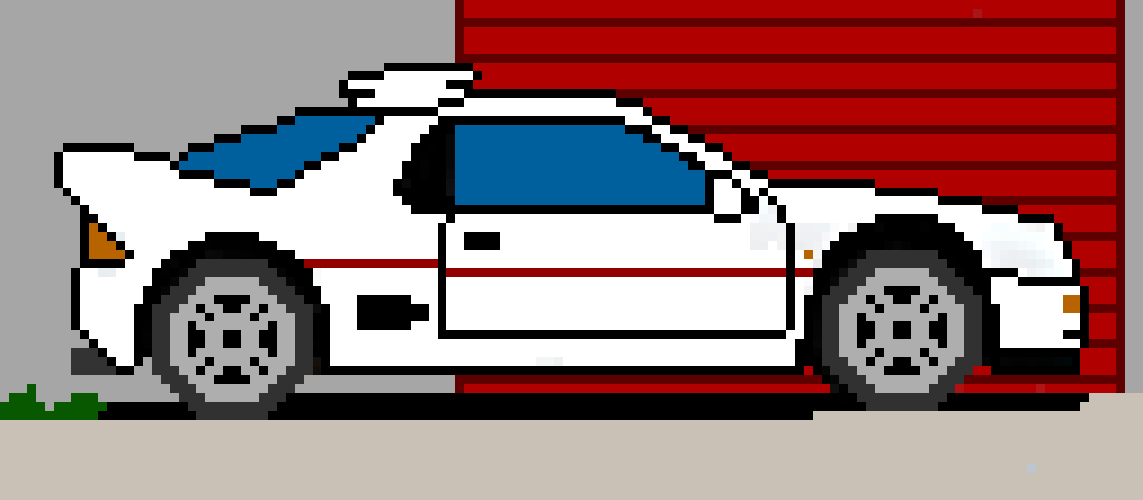
Find the location of a particular element. The image size is (1143, 500). the right front window is located at coordinates [586, 150].